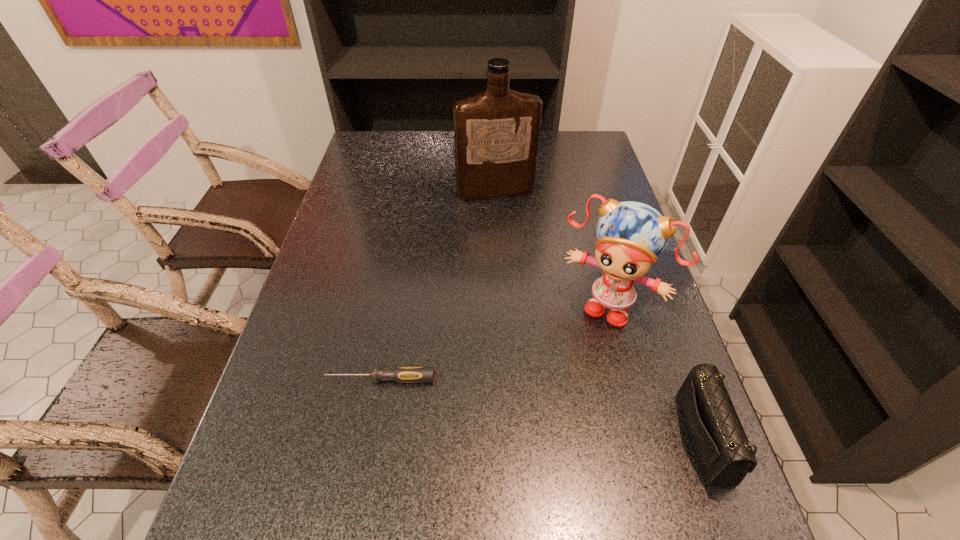
Image resolution: width=960 pixels, height=540 pixels. What are the coordinates of `vacant spot on the desktop that is between the shortest object and the nearest object and is positioned on the label side of the farthest object` in the screenshot? It's located at (573, 413).

Identify the location of vacant space on the desktop that is between the screwdriver and the nearest object and is positioned on the face of the doll. (556, 410).